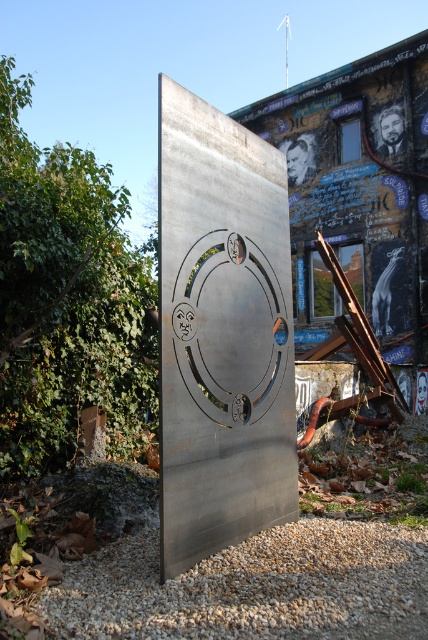
Is metallic silver circle at center to the left of gray gravel at lower center from the viewer's perspective?

Correct, you'll find metallic silver circle at center to the left of gray gravel at lower center.

Between metallic silver circle at center and gray gravel at lower center, which one appears on the right side from the viewer's perspective?

From the viewer's perspective, gray gravel at lower center appears more on the right side.

The height and width of the screenshot is (640, 428). Identify the location of metallic silver circle at center. (222, 332).

Where is `metallic silver circle at center`? metallic silver circle at center is located at coordinates (222, 332).